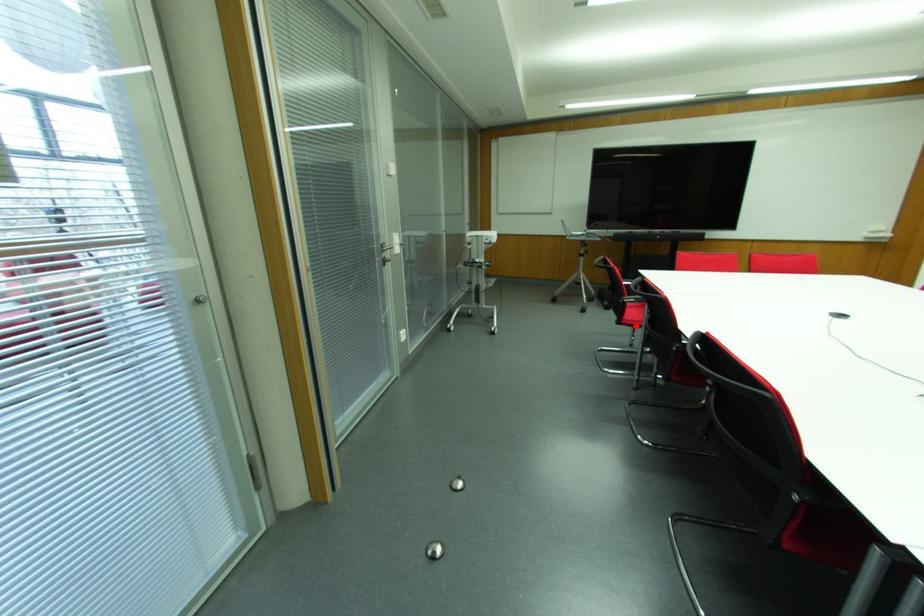
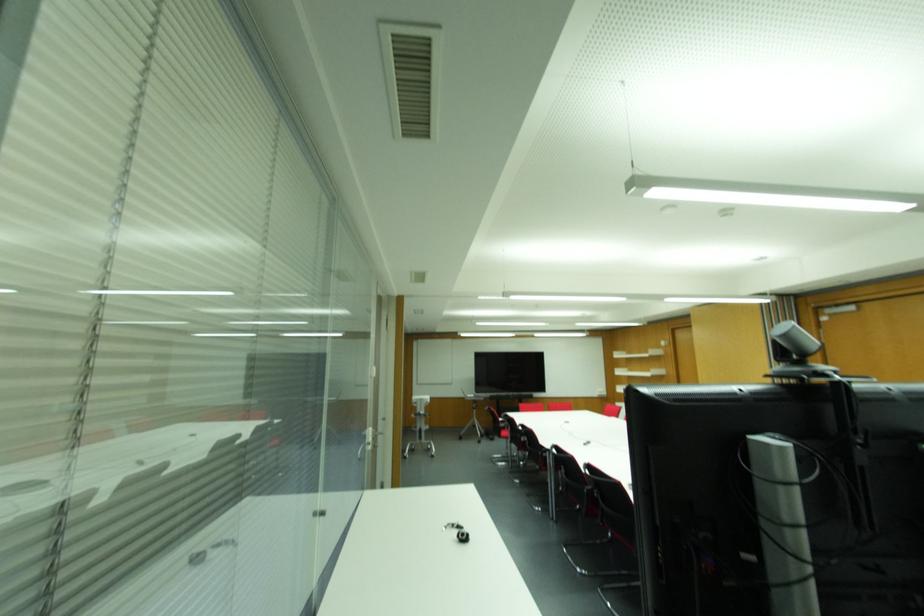
Question: I am providing you with two images of the same scene from different viewpoints. Given a red point in image1, look at the same physical point in image2. Is it:

Choices:
 (A) Closer to the viewpoint
 (B) Farther from the viewpoint

Answer: (B)